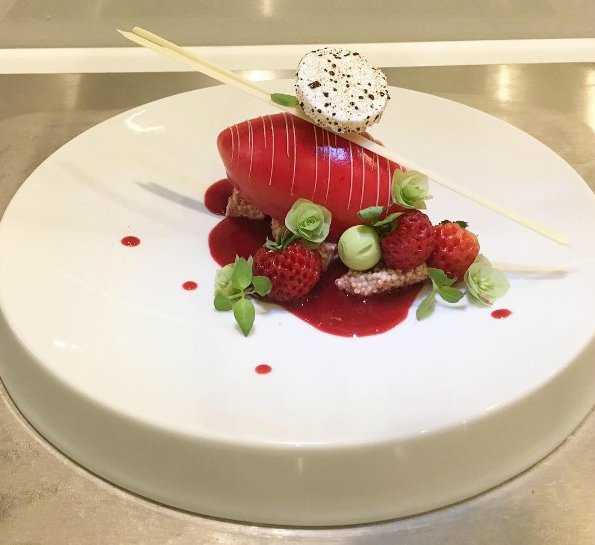
Identify the location of chop sticks. The width and height of the screenshot is (595, 545). (209, 68), (441, 184).